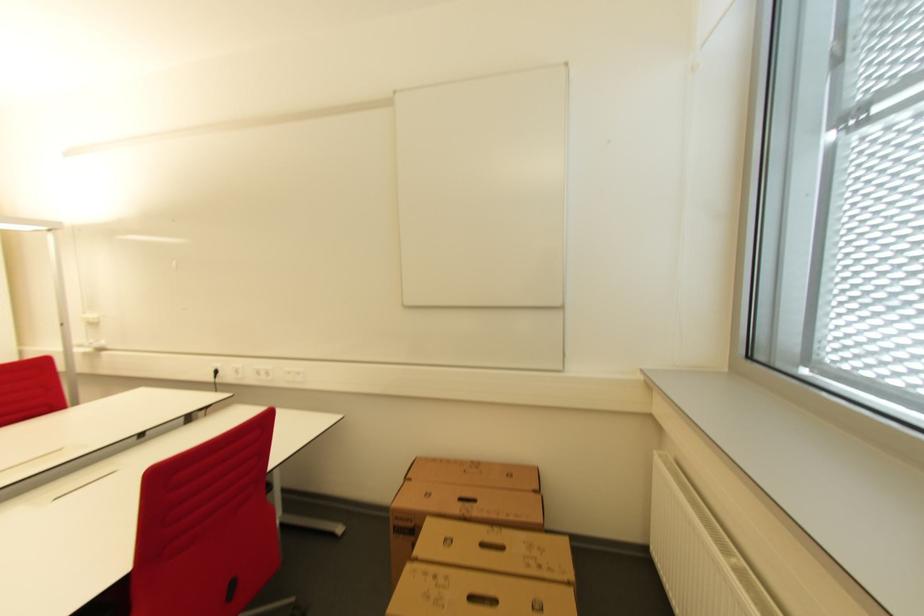
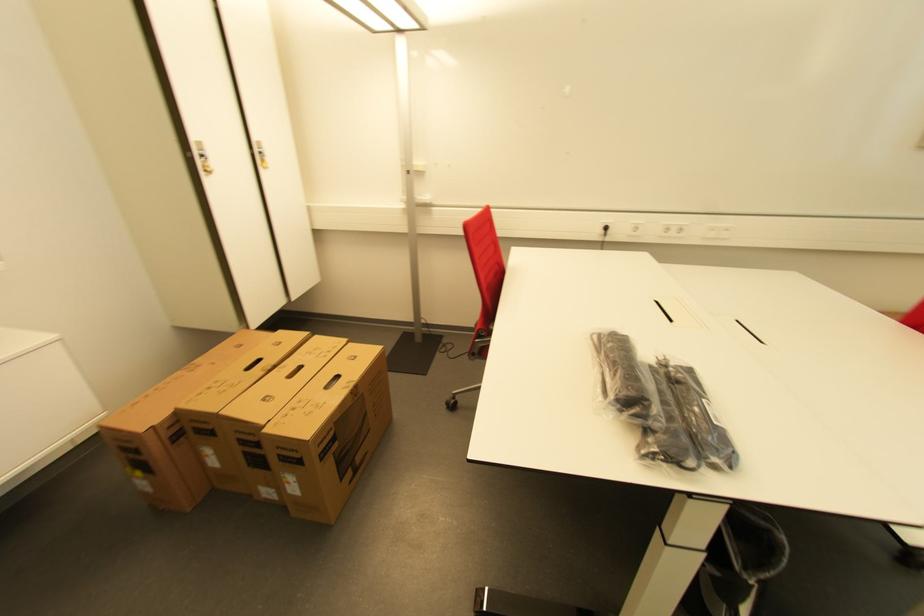
Where in the second image is the point corresponding to point 269,377 from the first image?

(676, 233)